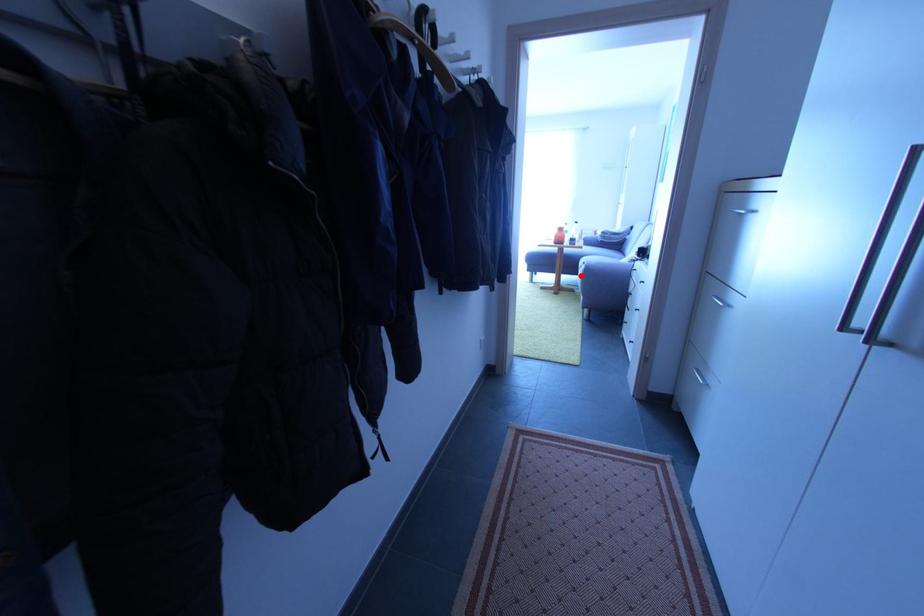
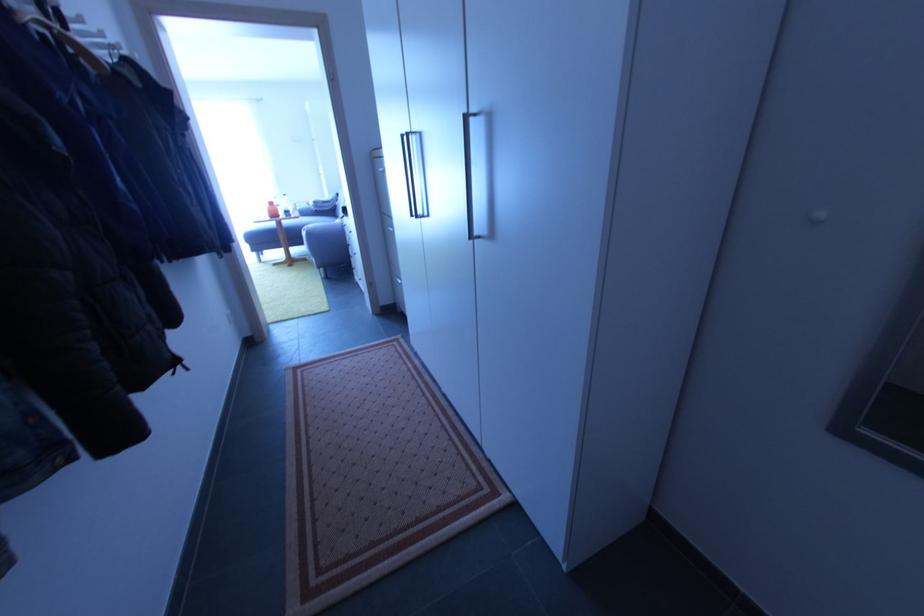
The point at the highlighted location is marked in the first image. Where is the corresponding point in the second image?

(308, 245)